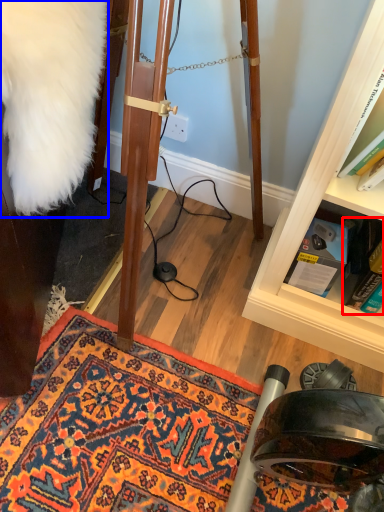
Question: Which of the following is the closest to the observer, book (highlighted by a red box) or fur coat (highlighted by a blue box)?

Choices:
 (A) book
 (B) fur coat

Answer: (B)